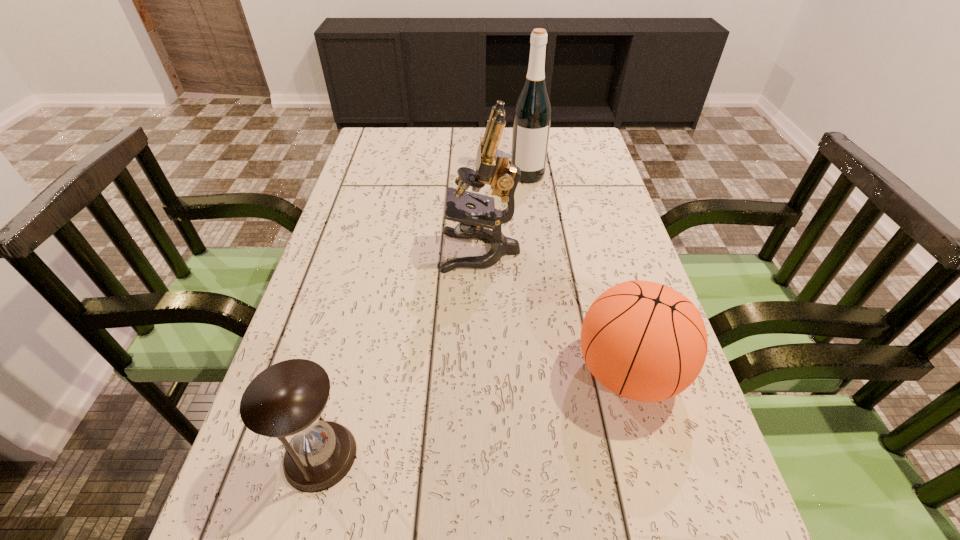
You are a GUI agent. You are given a task and a screenshot of the screen. Output one action in this format:
    pyautogui.click(x=<x>, y=<y>)
    Task: Click on the object that is at the left edge
    
    Given the screenshot: What is the action you would take?
    pyautogui.click(x=286, y=399)

Locate an element on the screen. This screenshot has width=960, height=540. object situated at the right edge is located at coordinates (644, 341).

This screenshot has width=960, height=540. In the image, there is a desktop. Identify the location of vacant space at the far edge. (456, 144).

Where is `free spot at the left edge of the desktop`? The image size is (960, 540). free spot at the left edge of the desktop is located at coordinates (348, 277).

Where is `free spot at the right edge of the desktop`? The width and height of the screenshot is (960, 540). free spot at the right edge of the desktop is located at coordinates (607, 168).

Where is `free space at the far right corner of the desktop`? The image size is (960, 540). free space at the far right corner of the desktop is located at coordinates (551, 127).

Locate an element on the screen. free space between the second farthest object and the basketball is located at coordinates (555, 312).

I want to click on free area in between the leftmost object and the farthest object, so pyautogui.click(x=424, y=315).

Locate an element on the screen. free space between the basketball and the second farthest object is located at coordinates (555, 312).

Image resolution: width=960 pixels, height=540 pixels. Identify the location of vacant space that is in between the basketball and the farthest object. (578, 273).